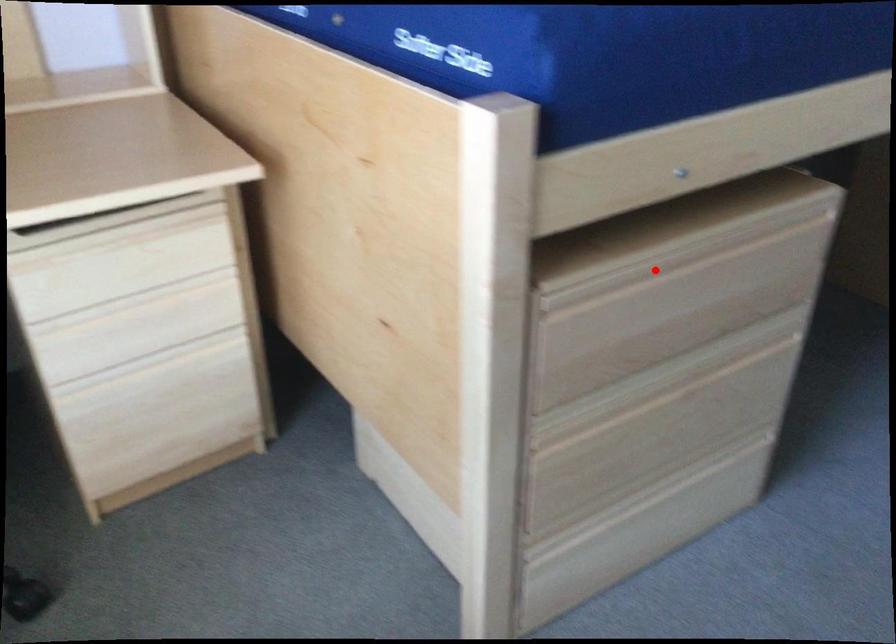
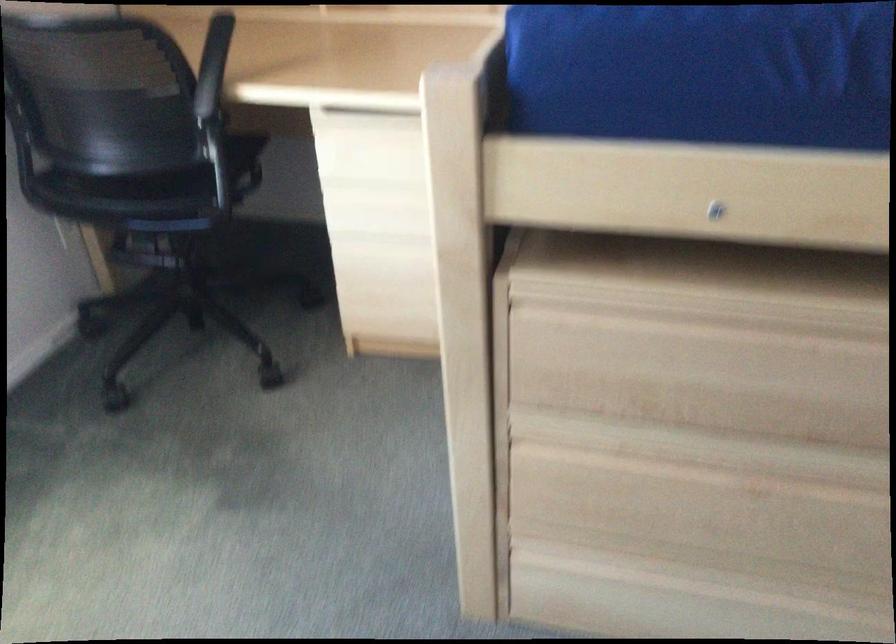
Where in the second image is the point corresponding to the highlighted location from the first image?

(711, 321)